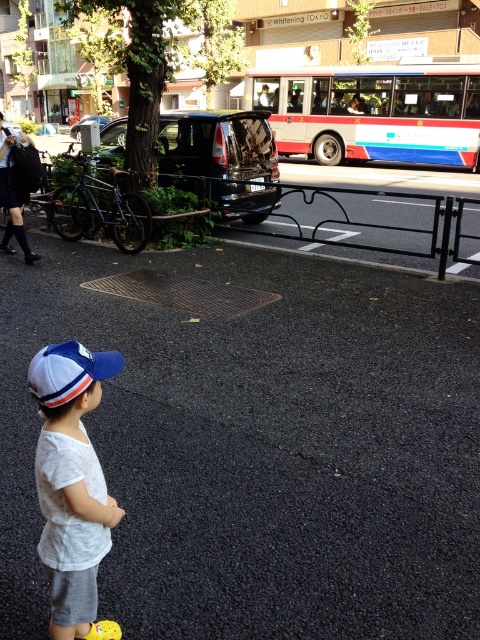
How distant is white cotton shirt at lower left from white matte baseball cap at lower left?

white cotton shirt at lower left and white matte baseball cap at lower left are 13.33 inches apart from each other.

Is point (93, 634) farther from camera compared to point (115, 368)?

Yes, point (93, 634) is behind point (115, 368).

At what (x,y) coordinates should I click in order to perform the action: click on white cotton shirt at lower left. Please return your answer as a coordinate pair (x, y). This screenshot has width=480, height=640. Looking at the image, I should click on (72, 484).

Who is higher up, white and blue painted bus at center or white cotton shirt at lower left?

Positioned higher is white and blue painted bus at center.

Consider the image. Who is more distant from viewer, (x=328, y=134) or (x=108, y=637)?

Positioned behind is point (x=328, y=134).

Is point (328, 81) farther from viewer compared to point (69, 566)?

Yes, it is.

Find the location of a particular element. Image resolution: width=480 pixels, height=640 pixels. white and blue painted bus at center is located at coordinates (372, 113).

Does white and blue painted bus at center have a greater height compared to white matte baseball cap at lower left?

Yes.

Can you confirm if white and blue painted bus at center is wider than white matte baseball cap at lower left?

Correct, the width of white and blue painted bus at center exceeds that of white matte baseball cap at lower left.

Where is `white and blue painted bus at center`? The image size is (480, 640). white and blue painted bus at center is located at coordinates (372, 113).